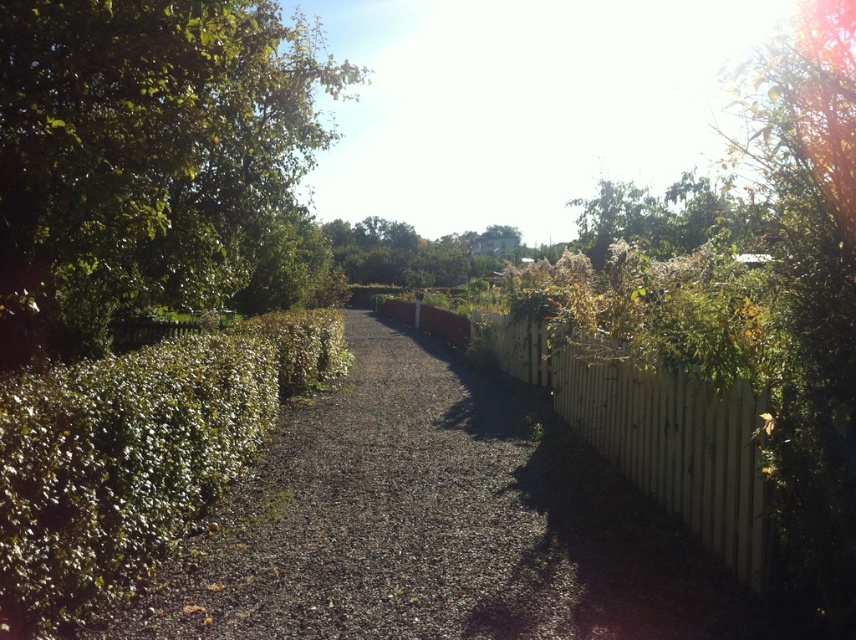
Question: Based on their relative distances, which object is farther from the green leafy hedge at left?

Choices:
 (A) dark gray gravel at center
 (B) white wooden fence at center-right

Answer: (B)

Question: Can you confirm if dark gray gravel at center is bigger than green leafy hedge at left?

Choices:
 (A) no
 (B) yes

Answer: (A)

Question: Which point appears closest to the camera in this image?

Choices:
 (A) (764, 492)
 (B) (7, 33)
 (C) (284, 540)

Answer: (A)

Question: Does green leafy bush at left have a lesser width compared to green leafy hedge at left?

Choices:
 (A) no
 (B) yes

Answer: (A)

Question: Considering the relative positions of dark gray gravel at center and green leafy bush at left in the image provided, where is dark gray gravel at center located with respect to green leafy bush at left?

Choices:
 (A) above
 (B) below

Answer: (B)

Question: Among these points, which one is nearest to the camera?

Choices:
 (A) (161, 4)
 (B) (578, 406)
 (C) (379, 508)

Answer: (A)